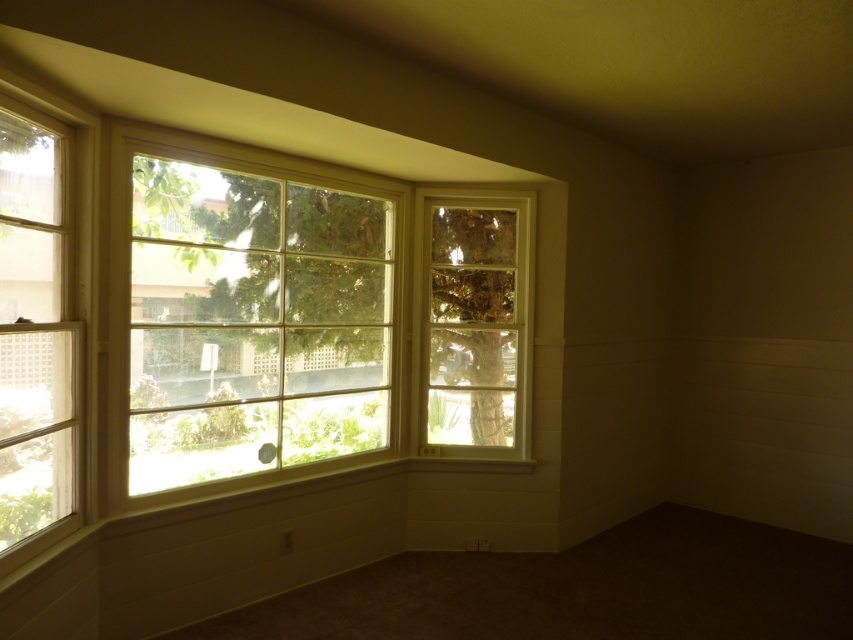
Is point (231, 234) farther from camera compared to point (68, 284)?

That is True.

Can you confirm if white wood window at upper left is bigger than clear glass window at left?

Indeed, white wood window at upper left has a larger size compared to clear glass window at left.

Between point (321, 360) and point (80, 476), which one is positioned in front?

Positioned in front is point (80, 476).

I want to click on white wood window at upper left, so click(252, 321).

The image size is (853, 640). Describe the element at coordinates (252, 321) in the screenshot. I see `white wood window at upper left` at that location.

Measure the distance between white wood window at upper left and camera.

white wood window at upper left and camera are 9.45 feet apart from each other.

Find the location of `white wood window at upper left`. white wood window at upper left is located at coordinates (252, 321).

Can you confirm if clear glass window at left is bigger than clear glass window at center?

No.

Is clear glass window at left shorter than clear glass window at center?

In fact, clear glass window at left may be taller than clear glass window at center.

This screenshot has width=853, height=640. Describe the element at coordinates (38, 336) in the screenshot. I see `clear glass window at left` at that location.

This screenshot has width=853, height=640. Identify the location of clear glass window at left. (38, 336).